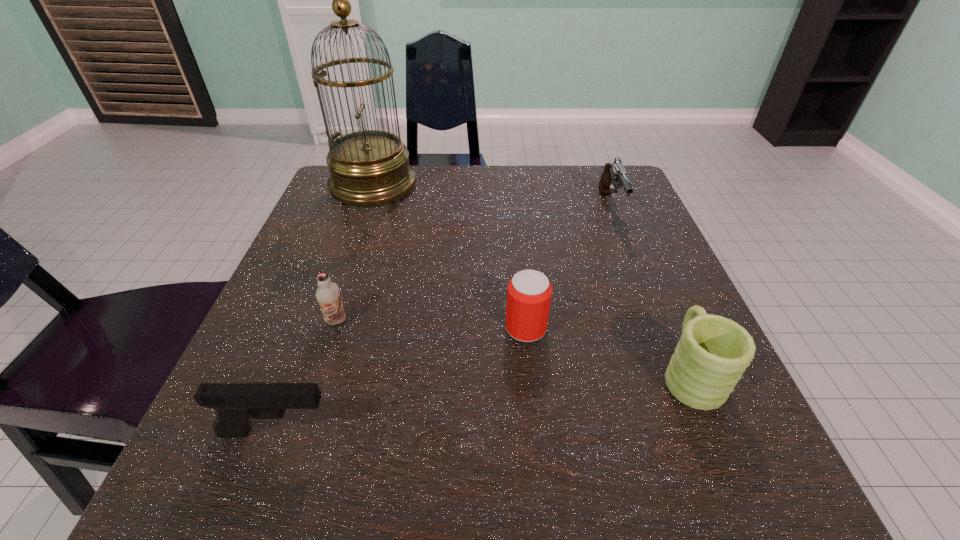
Where is `free space at the far left corner of the desktop`? free space at the far left corner of the desktop is located at coordinates pyautogui.click(x=384, y=206).

This screenshot has height=540, width=960. Find the location of `vacant space at the far right corner of the desktop`. vacant space at the far right corner of the desktop is located at coordinates (611, 207).

Find the location of a particular element. free spot between the chocolate milk and the beer can is located at coordinates (431, 325).

Where is `free point between the chocolate milk and the mug`? free point between the chocolate milk and the mug is located at coordinates (514, 347).

The width and height of the screenshot is (960, 540). Find the location of `free space between the chocolate milk and the mug`. free space between the chocolate milk and the mug is located at coordinates (514, 347).

Locate an element on the screen. empty space between the chocolate milk and the tallest object is located at coordinates (355, 253).

The image size is (960, 540). What are the coordinates of `vacant area between the beer can and the nearer pistol` in the screenshot? It's located at (401, 380).

You are a GUI agent. You are given a task and a screenshot of the screen. Output one action in this format:
    pyautogui.click(x=<x>, y=<y>)
    Task: Click on the vacant space that is in between the mug and the farther pistol
    This screenshot has width=960, height=540.
    Given the screenshot: What is the action you would take?
    pyautogui.click(x=650, y=291)

Identify the location of vacant area that lies between the nearer pistol and the fourth object from left to right. The height and width of the screenshot is (540, 960). (401, 380).

Where is `vacant point located between the right pistol and the birdcage`? This screenshot has width=960, height=540. vacant point located between the right pistol and the birdcage is located at coordinates coord(492,197).